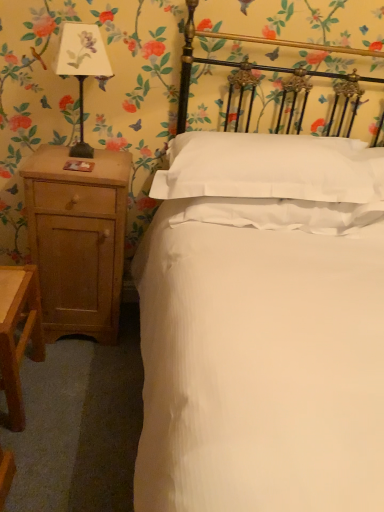
Question: In the image, is white smooth pillow at center on the left side or the right side of light brown wood nightstand at left?

Choices:
 (A) right
 (B) left

Answer: (A)

Question: Is white smooth pillow at center bigger or smaller than light brown wood nightstand at left?

Choices:
 (A) big
 (B) small

Answer: (A)

Question: Based on their relative distances, which object is farther from the white satin bed at center?

Choices:
 (A) matte black lampshade at left
 (B) light brown wood nightstand at left
 (C) white smooth pillow at center

Answer: (A)

Question: Based on their relative distances, which object is nearer to the light brown wood nightstand at left?

Choices:
 (A) white smooth pillow at center
 (B) matte black lampshade at left
 (C) white satin bed at center

Answer: (B)